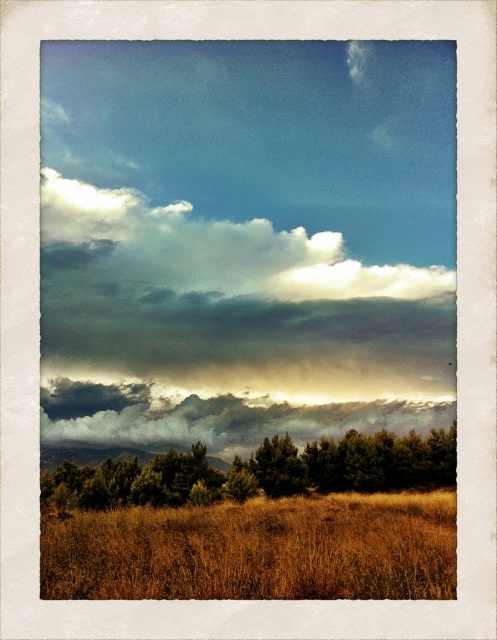
Question: Which object is farther from the camera taking this photo?

Choices:
 (A) green textured trees at lower center
 (B) cloudy textured sky at center
 (C) brown dry grass at lower center

Answer: (B)

Question: Which of the following is the farthest from the observer?

Choices:
 (A) (420, 592)
 (B) (66, 392)

Answer: (B)

Question: Does brown dry grass at lower center have a larger size compared to cloudy textured sky at center?

Choices:
 (A) yes
 (B) no

Answer: (A)

Question: Is green textured trees at lower center behind cloudy textured sky at center?

Choices:
 (A) yes
 (B) no

Answer: (B)

Question: Can you confirm if brown dry grass at lower center is smaller than cloudy textured sky at center?

Choices:
 (A) no
 (B) yes

Answer: (A)

Question: Which point appears closest to the camera in this image?

Choices:
 (A) (97, 483)
 (B) (121, 544)

Answer: (B)